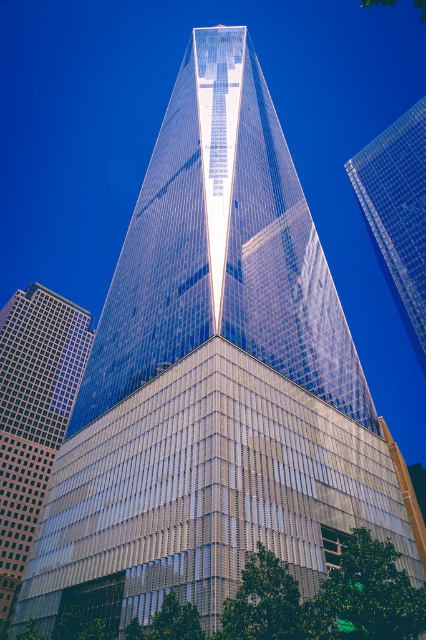
You are standing at the base of the glassy skyscraper at left and want to throw a ball to your friend standing at the transparent glass skyscraper at upper right. Considering the width of both buildings, which skyscraper has a wider base to aim for?

The glassy skyscraper at left has a wider base than the transparent glass skyscraper at upper right, so you should aim for the glassy skyscraper at left.

You are a drone operator who needs to fly a drone 120 meters away from the camera to capture aerial footage. Given that the glassy skyscraper at left is within your flight path, will the drone have to go around it to avoid collision?

The glassy skyscraper at left is 109.33 meters from camera, so the drone will need to go around it to avoid collision since it is closer than the 120 meters flight distance.

You are standing at the base of the skyscraper and looking up. There are two points marked on the building. One is at coordinates point [6,548] and the other is at point [405,257]. Which of these points is closer to your current position?

The point at coordinates point [6,548] is closer to the viewer than point [405,257], so the point at point [6,548] is closer to your current position.